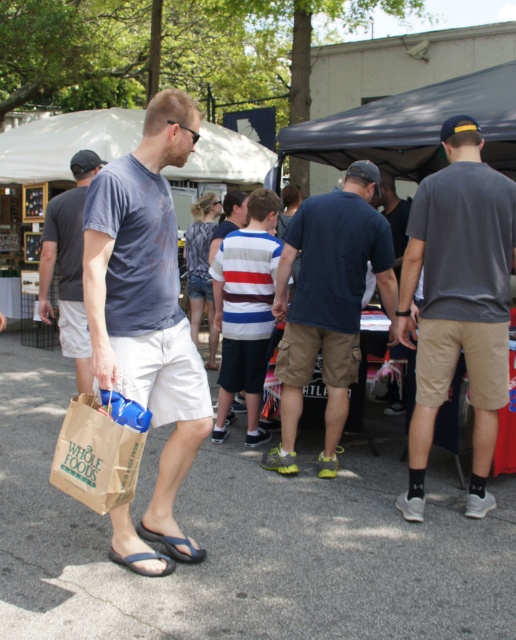
You are a fashion designer observing the market scene. You notice a striped cotton shirt at center and a blue fabric sandal at lower left. Which item is positioned higher in the image?

The striped cotton shirt at center is taller than blue fabric sandal at lower left, so the striped cotton shirt at center is positioned higher in the image.

You are a customer at the market and see the striped cotton shirt at center and the blue fabric sandal at lower left. Which item is closer to you?

The striped cotton shirt at center is closer to you because the blue fabric sandal at lower left is behind it.